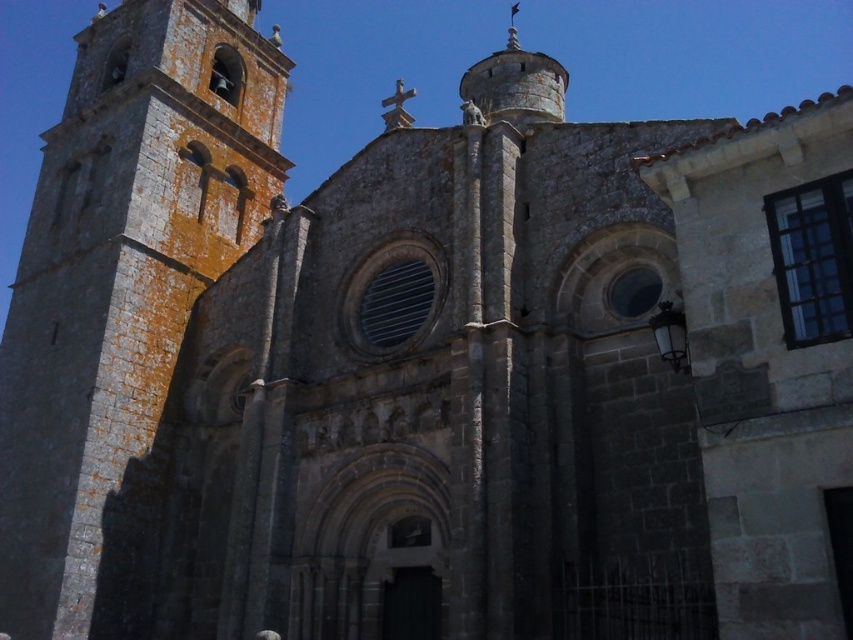
You are an architect inspecting the church structure. You need to determine which of the two structures, the greenish stone tower at left or the smooth stone spire at upper center, has a greater width. Based on the provided scene description, which one is wider?

The smooth stone spire at upper center is wider than the greenish stone tower at left.

You are standing in front of the historic stone church and want to take a photo of both the greenish stone tower at left and the smooth stone spire at upper center. Which one will appear lower in your photo?

The greenish stone tower at left appears lower in the photo because it is positioned below the smooth stone spire at upper center.